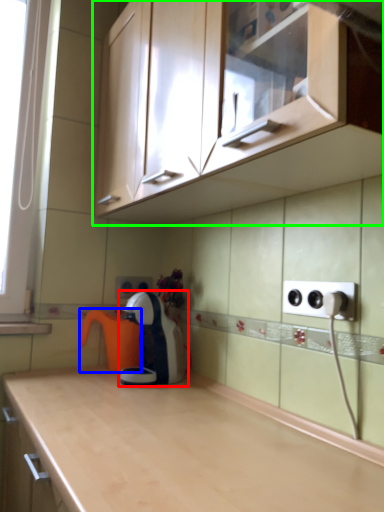
Question: Estimate the real-world distances between objects in this image. Which object is farther from home appliance (highlighted by a red box), coffeepot (highlighted by a blue box) or cabinetry (highlighted by a green box)?

Choices:
 (A) coffeepot
 (B) cabinetry

Answer: (B)